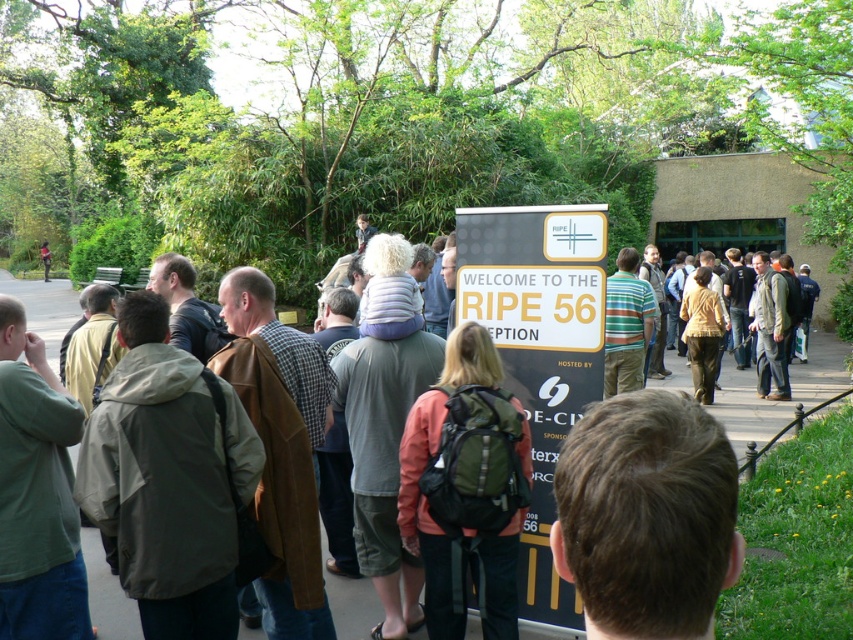
Question: Does brown hair at center have a smaller size compared to yellow plastic sign at center?

Choices:
 (A) no
 (B) yes

Answer: (B)

Question: Can you confirm if yellow plastic sign at center is thinner than reddish-orange backpack at center?

Choices:
 (A) no
 (B) yes

Answer: (A)

Question: Which point is farther from the camera taking this photo?

Choices:
 (A) (532, 209)
 (B) (593, 461)

Answer: (A)

Question: Which of the following is the farthest from the observer?

Choices:
 (A) reddish-orange backpack at center
 (B) yellow plastic sign at center
 (C) brown hair at center

Answer: (B)

Question: Which of the following is the farthest from the observer?

Choices:
 (A) (491, 348)
 (B) (537, 500)
 (C) (618, 548)

Answer: (B)

Question: From the image, what is the correct spatial relationship of brown hair at center in relation to yellow plastic sign at center?

Choices:
 (A) above
 (B) below

Answer: (A)